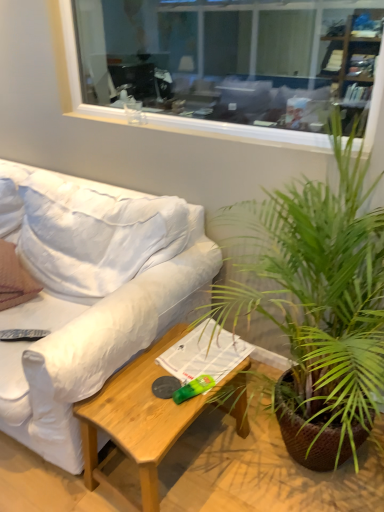
Question: In terms of height, does brown textured pillow at left look taller or shorter compared to white fabric couch at left?

Choices:
 (A) tall
 (B) short

Answer: (B)

Question: From a real-world perspective, is brown textured pillow at left positioned above or below white fabric couch at left?

Choices:
 (A) below
 (B) above

Answer: (B)

Question: Which is farther from the green leafy plant at center-right?

Choices:
 (A) black plastic remote control at lower left
 (B) light brown wood coffee table at lower center
 (C) white fabric couch at left
 (D) clear glass window at upper center
 (E) brown textured pillow at left

Answer: (D)

Question: Which of these objects is positioned farthest from the light brown wood coffee table at lower center?

Choices:
 (A) white fabric couch at left
 (B) clear glass window at upper center
 (C) green leafy plant at center-right
 (D) black plastic remote control at lower left
 (E) brown textured pillow at left

Answer: (B)